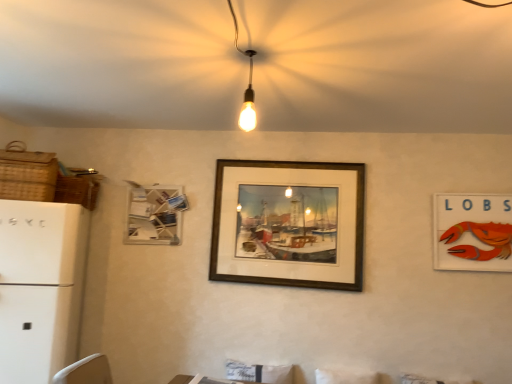
Question: Considering the positions of white matte refrigerator at left and orange felt lobster sign at right, the 1th picture frame viewed from the right, in the image, is white matte refrigerator at left taller or shorter than orange felt lobster sign at right, the 1th picture frame viewed from the right,?

Choices:
 (A) short
 (B) tall

Answer: (B)

Question: In terms of size, does white matte refrigerator at left appear bigger or smaller than orange felt lobster sign at right, the 1th picture frame viewed from the right?

Choices:
 (A) small
 (B) big

Answer: (B)

Question: Estimate the real-world distances between objects in this image. Which object is farther from the white matte refrigerator at left?

Choices:
 (A) woven brown basket at left, which is the first basket from front to back
 (B) orange felt lobster sign at right, marked as the third picture frame in a left-to-right arrangement
 (C) white matte picture frame at upper left, the first picture frame when ordered from left to right
 (D) wooden frame at center, the second picture frame viewed from the left
 (E) woven brown basket at upper left, placed as the second basket when sorted from front to back

Answer: (B)

Question: Which is farther from the woven brown basket at left, the 2th basket from the back?

Choices:
 (A) white matte refrigerator at left
 (B) white matte picture frame at upper left, the first picture frame when ordered from left to right
 (C) wooden frame at center, arranged as the 2th picture frame when viewed from the right
 (D) woven brown basket at upper left, placed as the second basket when sorted from front to back
 (E) orange felt lobster sign at right, the 1th picture frame viewed from the right

Answer: (E)